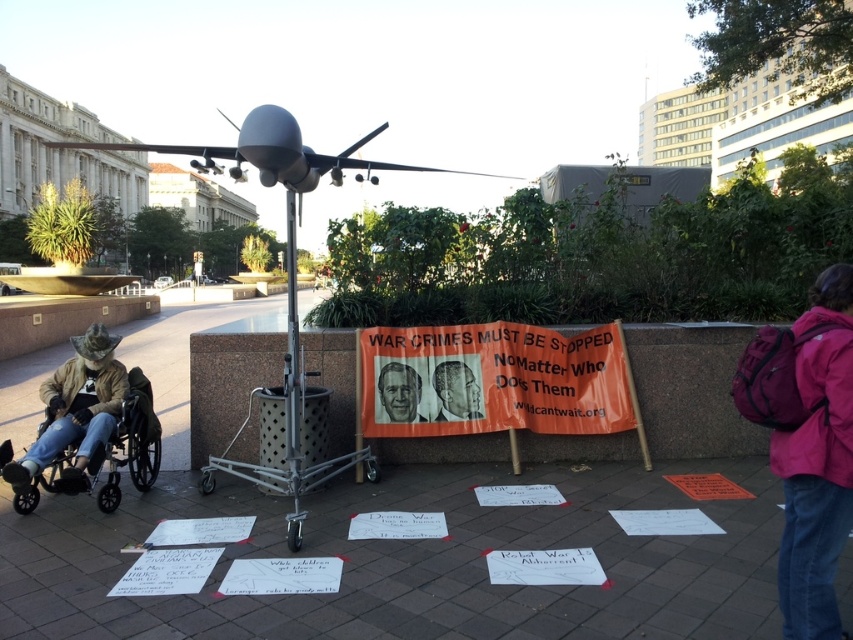
Based on the photo, you are a delivery robot with a 1.2 meter width. You need to navigate through the protest area shown in the image. Can you pass between the concrete pavement at center and the black plastic wheelchair at lower left without touching either?

The concrete pavement at center is wider than the black plastic wheelchair at lower left. Since the pavement is wider, the robot can pass through the space between them as long as it stays on the pavement. However, the exact width of the pavement isn not specified, so we cannot confirm if it is exactly 1.2 meters or more. The answer should reflect that the pavement is wider than the wheelchair, but without knowing the exact width, we can only say it might be possible if the pavement is sufficiently wide.

You are a photographer standing at the center of the plaza, and you want to take a photo of both point (x=614, y=618) and point (x=781, y=544). Which point is closer to your camera?

Point (x=781, y=544) is closer to the camera because it is less further than point (x=614, y=618).